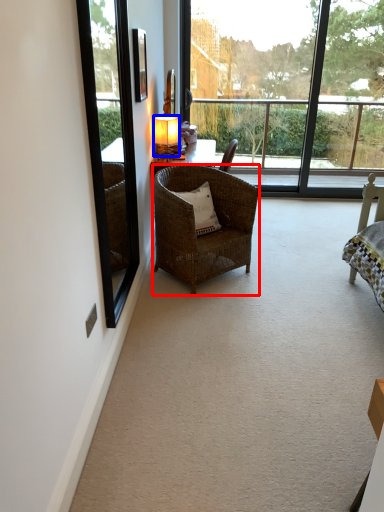
Question: Which of the following is the farthest to the observer, chair (highlighted by a red box) or lamp (highlighted by a blue box)?

Choices:
 (A) chair
 (B) lamp

Answer: (B)